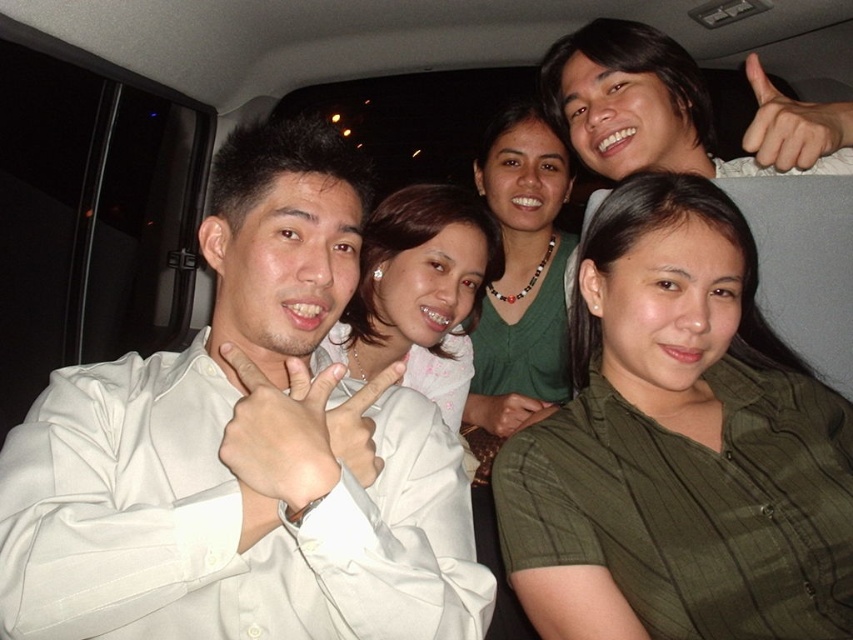
Describe the element at coordinates (521, 275) in the screenshot. I see `green fabric shirt at center` at that location.

The width and height of the screenshot is (853, 640). I want to click on green fabric shirt at center, so click(x=521, y=275).

At what (x,y) coordinates should I click in order to perform the action: click on green fabric shirt at center. Please return your answer as a coordinate pair (x, y). The width and height of the screenshot is (853, 640). Looking at the image, I should click on (521, 275).

Does green fabric shirt at center come in front of white matte hand at center?

No, it is not.

In the scene shown: Who is higher up, green fabric shirt at center or white matte hand at center?

Positioned higher is white matte hand at center.

This screenshot has height=640, width=853. I want to click on green fabric shirt at center, so point(521,275).

Image resolution: width=853 pixels, height=640 pixels. Identify the location of green fabric shirt at center. (521, 275).

Can you confirm if green striped shirt at lower right is taller than white matte hand at center?

Yes.

The image size is (853, 640). Describe the element at coordinates (679, 445) in the screenshot. I see `green striped shirt at lower right` at that location.

Where is `green striped shirt at lower right`? Image resolution: width=853 pixels, height=640 pixels. green striped shirt at lower right is located at coordinates (679, 445).